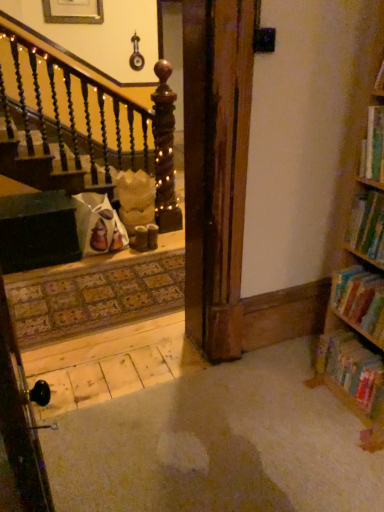
At what (x,y) coordinates should I click in order to perform the action: click on vacant space in multicolored cardboard book at lower right, arranged as the first book when ordered from the bottom (from a real-world perspective). Please return your answer as a coordinate pair (x, y). The image size is (384, 512). Looking at the image, I should click on (344, 405).